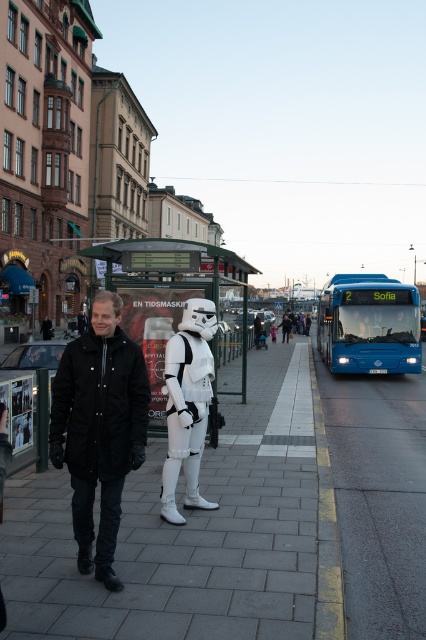
You are a pedestrian standing at the bus stop and want to cross the smooth asphalt road at center to reach the other side. The blue metallic bus at center is parked there. Is the bus blocking your path?

The smooth asphalt road at center is closer to the viewer than the blue metallic bus at center, so the bus is parked behind the road. Therefore, the bus is not blocking your path as it is behind the road.

Based on the photo, you are a pedestrian standing at the bus stop and want to walk to the smooth asphalt road at center. Which direction should you move relative to the black matte jacket at center?

The smooth asphalt road at center is positioned on the right side of the black matte jacket at center, so you should move to the right of the black matte jacket at center to reach the smooth asphalt road at center.

You are a photographer trying to capture a clear shot of both the black matte jacket at center and the white plastic bus stop at center. Since you want to ensure both are fully visible in your photo, which object should you focus on first to avoid cropping either?

The black matte jacket at center has a lesser height compared to white plastic bus stop at center, so you should focus on the white plastic bus stop at center first to ensure it is fully captured in the frame before adjusting for the jacket.